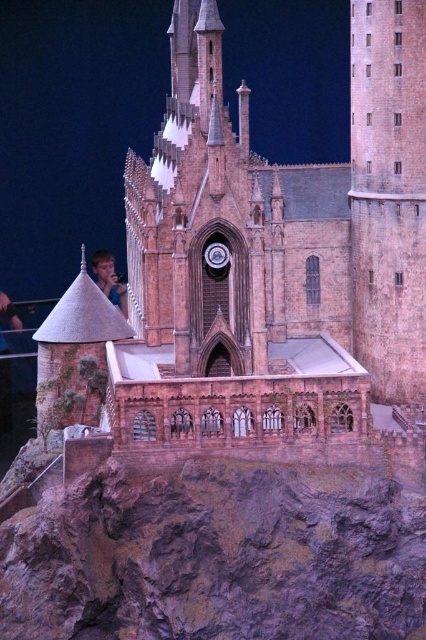
At what (x,y) coordinates should I click in order to perform the action: click on brown brick church at center. Please return your answer as a coordinate pair (x, y). The width and height of the screenshot is (426, 640). Looking at the image, I should click on (279, 262).

Between point (115, 358) and point (94, 260), which one is positioned behind?

Point (94, 260)

Is point (195, 138) positioned after point (115, 291)?

No, (195, 138) is in front of (115, 291).

You are a GUI agent. You are given a task and a screenshot of the screen. Output one action in this format:
    pyautogui.click(x=<x>, y=<y>)
    Task: Click on the brown brick church at center
    
    Given the screenshot: What is the action you would take?
    pyautogui.click(x=279, y=262)